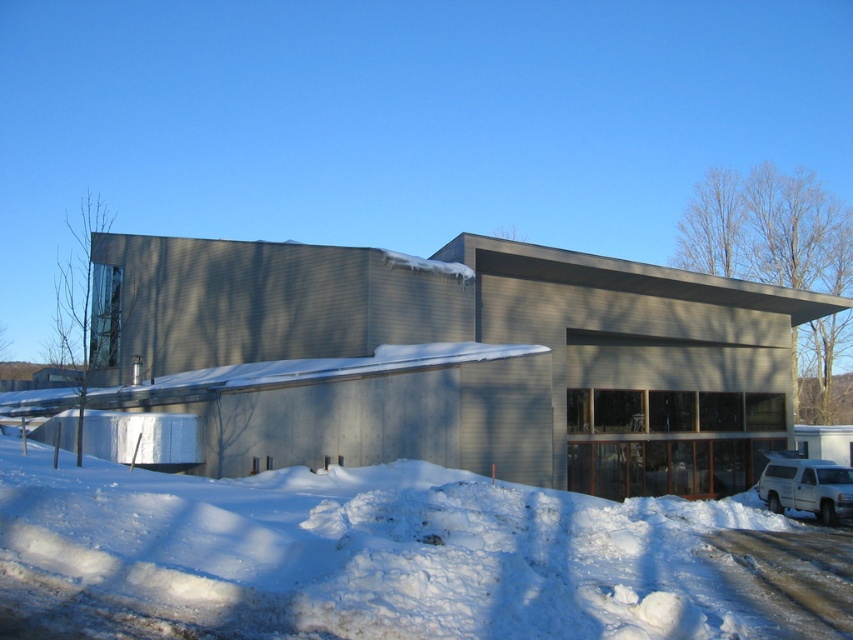
You are a delivery person with a package that needs to be delivered to the building. You are currently standing at the white fluffy snow at lower center. The white matte suv at lower right is blocking the entrance. Can you walk around the suv to reach the building entrance without going through the snow?

The distance between the white fluffy snow at lower center and the white matte suv at lower right is 13.90 meters. Since the suv is blocking the entrance, you can walk around it to reach the building entrance without going through the snow as long as there is a clear path around the suv. However, the provided information does not specify the presence of a clear path around the suv, so it is uncertain.

You are standing in front of the modern building and want to take a photo. You notice two points marked on the building facade. Which point, point [280,627] or point [776,499], is closer to your current position?

Point [280,627] is closer to the camera than point [776,499], so it is closer to your current position.

You are a delivery person trying to park your white matte suv at lower right near the white fluffy snow at lower center. Can you safely park the suv without getting stuck in the snow?

The white fluffy snow at lower center is above the white matte suv at lower right, which means the snow is higher than the suv. This indicates that the suv might be partially buried or submerged in the snow, so parking there could cause the vehicle to get stuck.